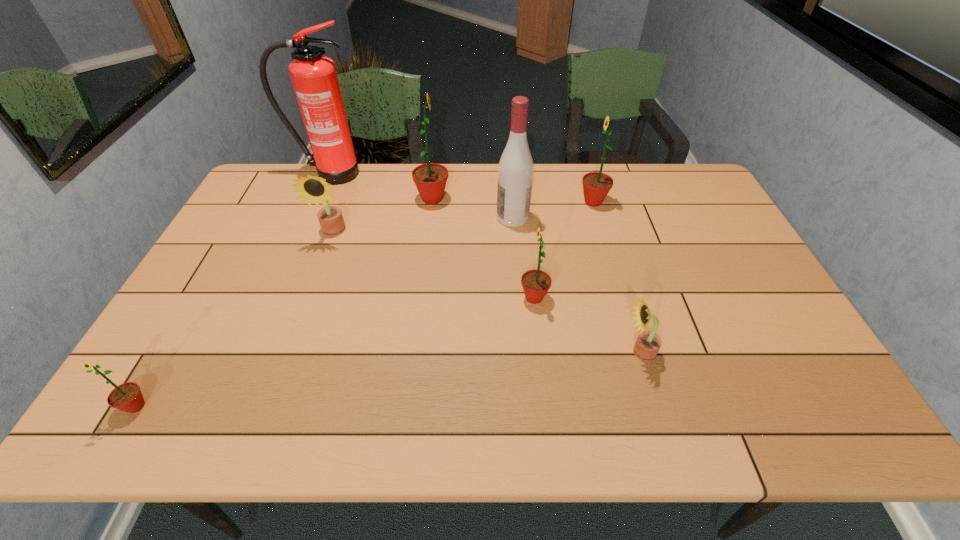
Locate an element on the screen. The height and width of the screenshot is (540, 960). free region at the far left corner is located at coordinates (268, 198).

You are a GUI agent. You are given a task and a screenshot of the screen. Output one action in this format:
    pyautogui.click(x=<x>, y=<y>)
    Task: Click on the free space between the smaller yellow sunflower and the farthest object
    The width and height of the screenshot is (960, 540).
    Given the screenshot: What is the action you would take?
    pyautogui.click(x=485, y=263)

I want to click on free area in between the alcohol and the left yellow sunflower, so click(x=422, y=225).

This screenshot has height=540, width=960. In order to click on free space between the alcohol and the fifth shortest object in this screenshot , I will do `click(553, 210)`.

Find the location of `unoccupied area between the alcohol and the second smallest green sunflower`. unoccupied area between the alcohol and the second smallest green sunflower is located at coordinates (523, 258).

You are a GUI agent. You are given a task and a screenshot of the screen. Output one action in this format:
    pyautogui.click(x=<x>, y=<y>)
    Task: Click on the free spot between the fourth tallest object and the second nearest object
    This screenshot has width=960, height=540.
    Given the screenshot: What is the action you would take?
    pyautogui.click(x=616, y=277)

Find the location of a particular element. The height and width of the screenshot is (540, 960). vacant area that lies between the second sunflower from left to right and the second green sunflower from left to right is located at coordinates (383, 215).

I want to click on unoccupied position between the third nearest sunflower and the fifth object from right to left, so click(x=483, y=248).

Where is `unoccupied area between the third farthest sunflower and the rightmost green sunflower`? unoccupied area between the third farthest sunflower and the rightmost green sunflower is located at coordinates (463, 217).

I want to click on the fifth closest object to the nearest object, so pyautogui.click(x=515, y=171).